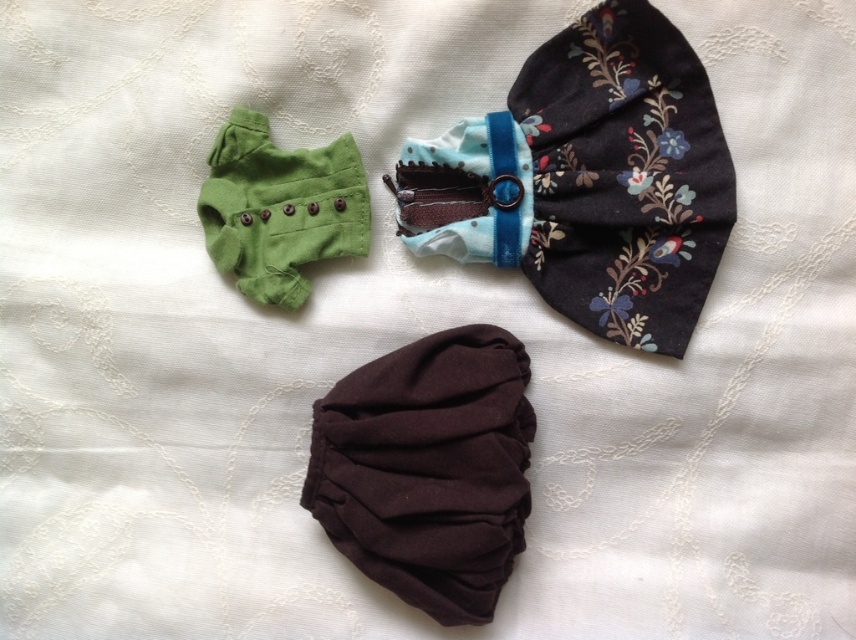
You are standing in front of the three fabric items on the white lace surface. There are two points marked on the image. Point A is at coordinates point (596,83) and Point B is at point (441,618). Which point is closer to you?

Point A at point (596,83) is closer to you because it is further to the camera than point B at point (441,618).

You are organizing a small doll wardrobe and need to place the floral fabric bow tie at upper center and the brown cotton pants at center into a drawer. The drawer has a divider that separates items into left and right sections. Based on their positions in the image, which side should you place each item in the drawer?

The floral fabric bow tie at upper center should be placed in the right section and the brown cotton pants at center in the left section because the bow tie is positioned to the right of the pants in the image.